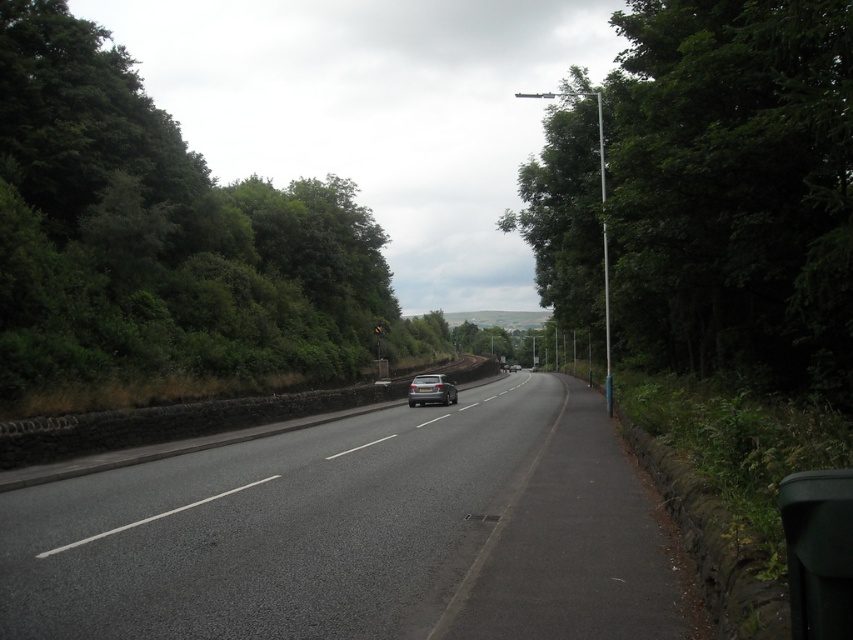
You are a pedestrian standing on the sidewalk on the right side of the road. You want to cross to the other side of the road. Which direction should you walk to find a place where the black asphalt highway at center and the green leafy trees at left are aligned in a way that allows you to cross safely?

You should walk towards the direction where the black asphalt highway at center is below the green leafy trees at left, as this alignment indicates a possible pedestrian crossing or a safe path near that area.

You are standing at the point marked as point (358, 532). What is the surface material you are currently standing on?

The surface material at point (358, 532) is black asphalt highway at center.